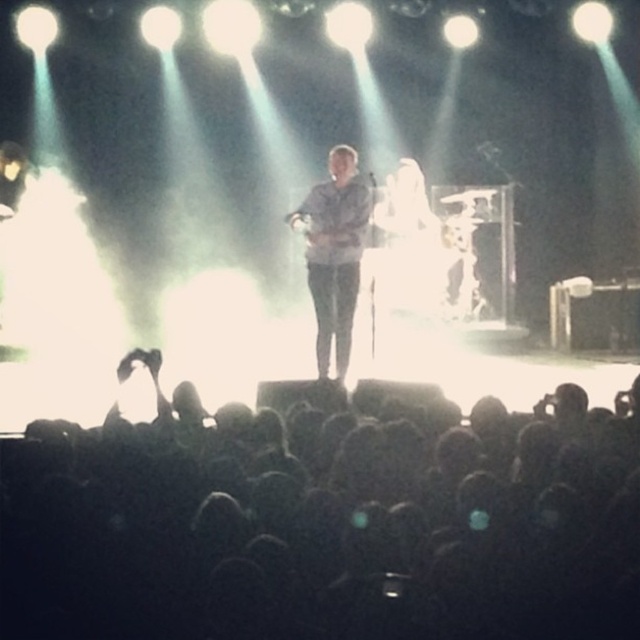
From the picture: You are a photographer at the concert. You want to capture a photo that includes both the black matte crowd at lower center and the light blue denim shirt at center. Which object should you focus on first to ensure both are in frame?

Since the black matte crowd at lower center is not as tall as the light blue denim shirt at center, you should focus on the light blue denim shirt at center first to ensure both are in frame.

You are a photographer trying to capture the light blue denim shirt at center and the black matte crowd at lower center in a single shot. Which object is closer to your camera lens?

The black matte crowd at lower center is closer to the viewer than the light blue denim shirt at center, so it will appear closer to the camera lens.

You are a photographer at the concert. You want to take a picture of the light blue denim shirt at center without the black matte crowd at lower center blocking the view. Which direction should you move your camera to avoid the crowd?

Move your camera to the left of the light blue denim shirt at center to avoid the black matte crowd at lower center, since the crowd is positioned to the right of the shirt.